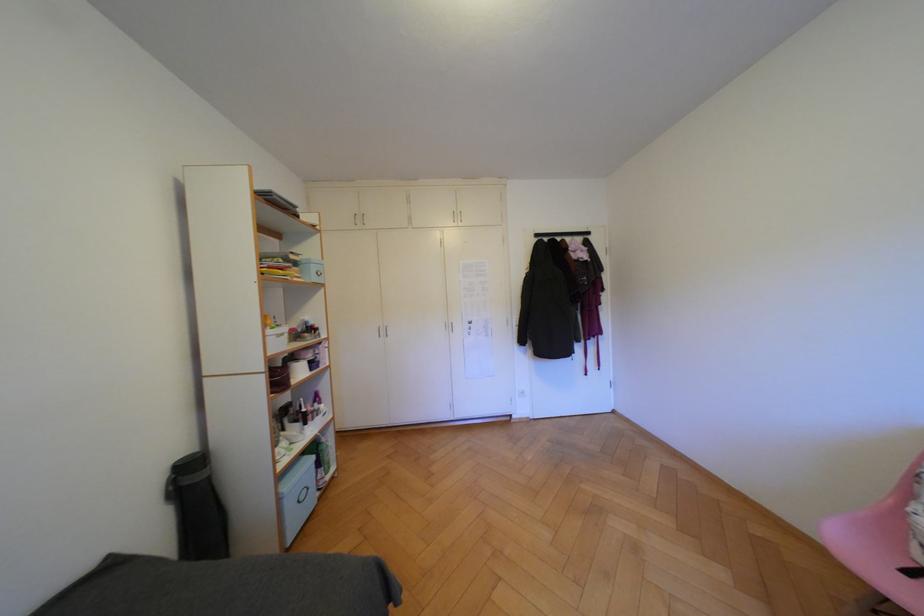
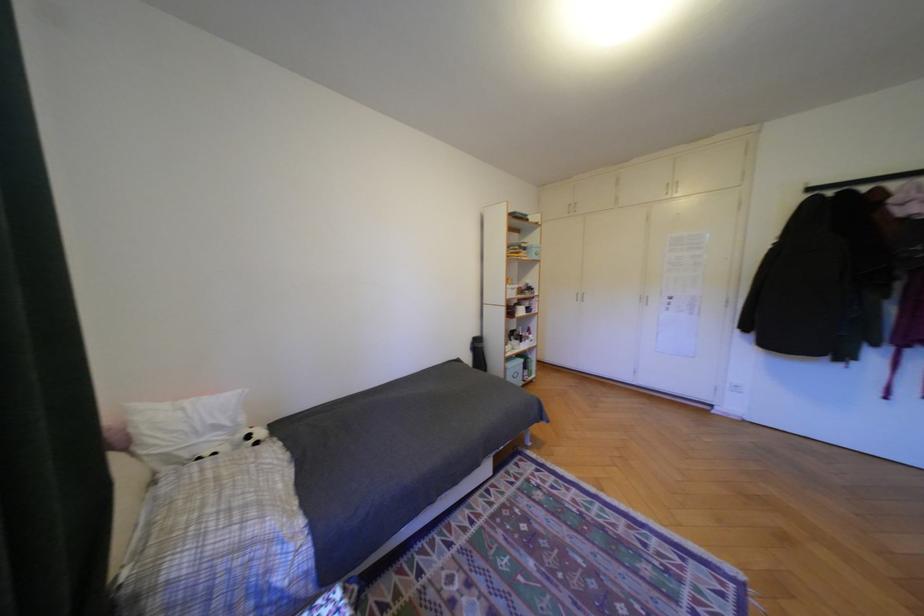
In the second image, find the point that corresponds to the point at 292,500 in the first image.

(517, 370)